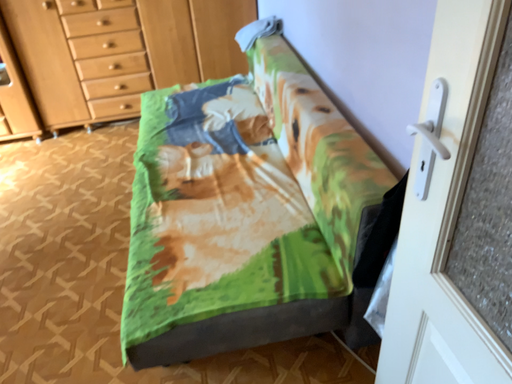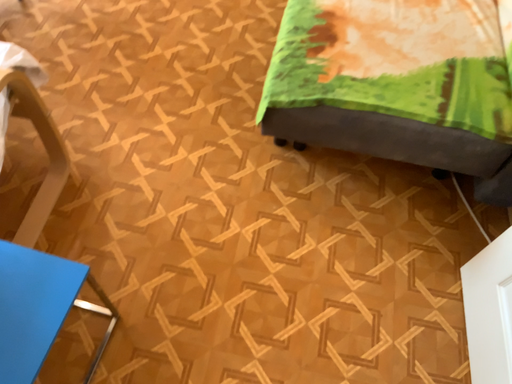
Question: How did the camera likely rotate when shooting the video?

Choices:
 (A) rotated left
 (B) rotated right

Answer: (A)